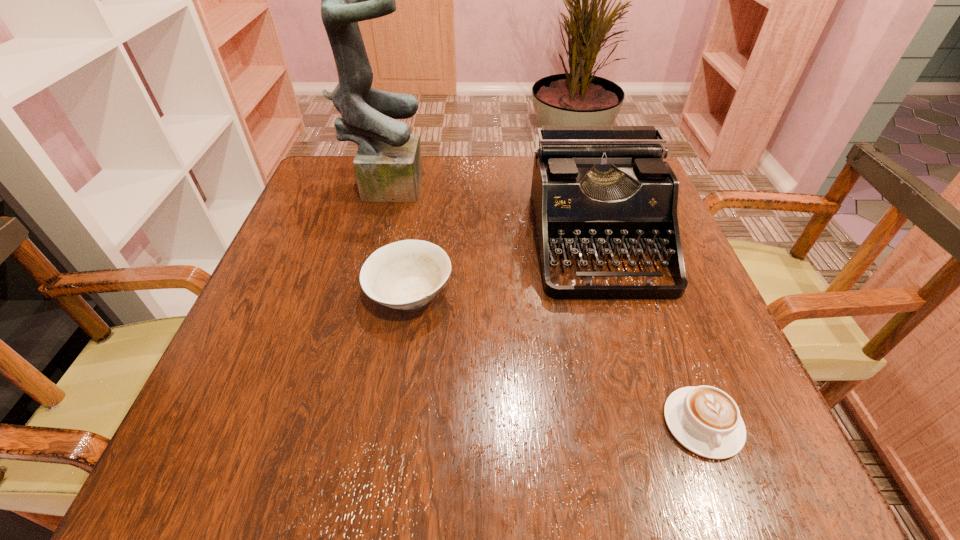
The width and height of the screenshot is (960, 540). What are the coordinates of `empty space that is in between the second shortest object and the cappuccino` in the screenshot? It's located at (556, 359).

Identify the location of vacant area that lies between the shortest object and the tallest object. (543, 302).

Where is `object that can be found as the third closest to the bowl`? object that can be found as the third closest to the bowl is located at coordinates (705, 420).

Identify the location of object identified as the closest to the typewriter. (407, 274).

Locate an element on the screen. free space that satisfies the following two spatial constraints: 1. on the face of the third tallest object; 2. on the left side of the sculpture is located at coordinates (354, 294).

The width and height of the screenshot is (960, 540). What are the coordinates of `vacant point that satisfies the following two spatial constraints: 1. on the face of the bowl; 2. on the right side of the tallest object` in the screenshot? It's located at (354, 294).

At what (x,y) coordinates should I click in order to perform the action: click on vacant space that satisfies the following two spatial constraints: 1. on the face of the third tallest object; 2. on the left side of the tallest object. Please return your answer as a coordinate pair (x, y). This screenshot has height=540, width=960. Looking at the image, I should click on (354, 294).

Locate an element on the screen. The height and width of the screenshot is (540, 960). vacant area in the image that satisfies the following two spatial constraints: 1. on the face of the tallest object; 2. on the left side of the second shortest object is located at coordinates (354, 294).